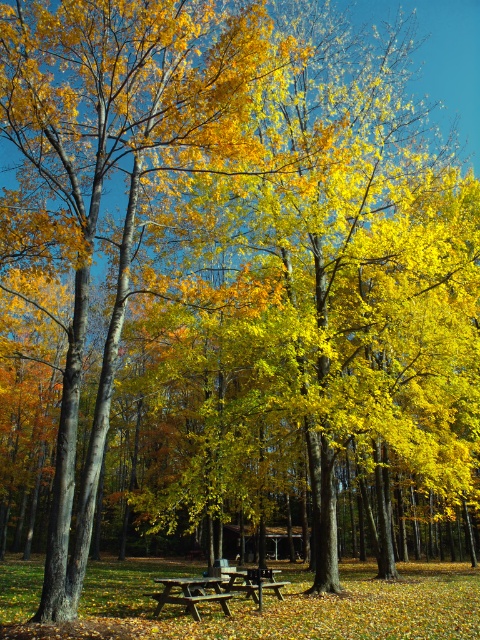
Question: Among these points, which one is farthest from the camera?

Choices:
 (A) (202, 588)
 (B) (207, 584)

Answer: (A)

Question: Does wooden picnic table at center appear on the left side of wooden picnic table at lower center?

Choices:
 (A) no
 (B) yes

Answer: (B)

Question: Which of the following is the farthest from the observer?

Choices:
 (A) (163, 595)
 (B) (254, 586)

Answer: (B)

Question: Among these objects, which one is farthest from the camera?

Choices:
 (A) wooden picnic table at lower center
 (B) wooden picnic table at center

Answer: (A)

Question: Does wooden picnic table at center have a larger size compared to wooden picnic table at lower center?

Choices:
 (A) no
 (B) yes

Answer: (B)

Question: Can you confirm if wooden picnic table at center is wider than wooden picnic table at lower center?

Choices:
 (A) no
 (B) yes

Answer: (B)